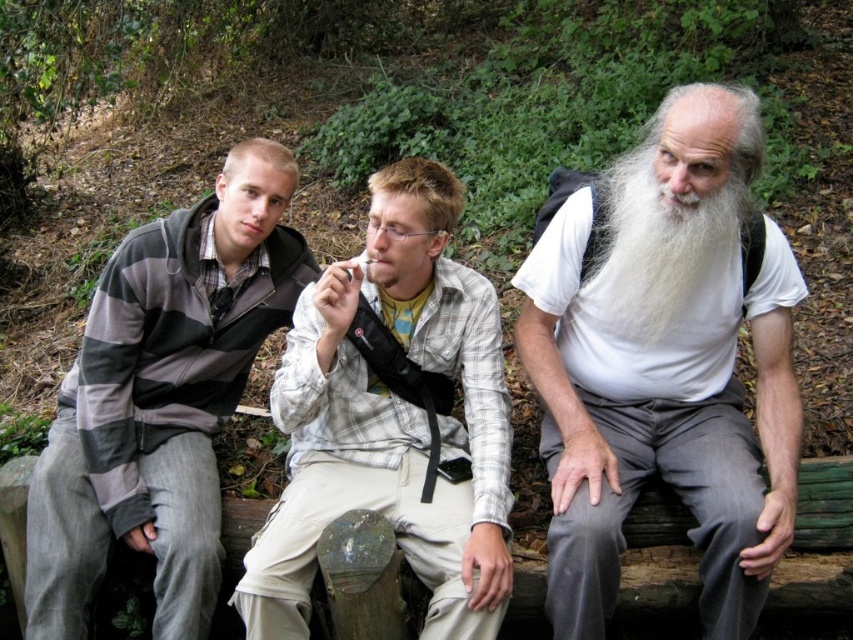
This screenshot has height=640, width=853. What are the coordinates of `striped fleece jacket at left` in the screenshot? It's located at pyautogui.click(x=161, y=400).

Who is more distant from viewer, (282, 291) or (642, 253)?

Positioned behind is point (282, 291).

Where is `striped fleece jacket at left`? The height and width of the screenshot is (640, 853). striped fleece jacket at left is located at coordinates (161, 400).

Can you confirm if striped fleece jacket at left is positioned to the right of light brown plaid shirt at center?

In fact, striped fleece jacket at left is to the left of light brown plaid shirt at center.

Between point (230, 240) and point (294, 310), which one is positioned in front?

Point (294, 310) is in front.

Which is in front, point (173, 593) or point (480, 401)?

Point (173, 593)

Find the location of a particular element. striped fleece jacket at left is located at coordinates (161, 400).

What do you see at coordinates (665, 365) in the screenshot? I see `white matte beard at center` at bounding box center [665, 365].

Is white matte beard at center shorter than striped fleece jacket at left?

Indeed, white matte beard at center has a lesser height compared to striped fleece jacket at left.

Measure the distance between point (679, 227) and camera.

Point (679, 227) is 6.99 feet away from camera.

Locate an element on the screen. Image resolution: width=853 pixels, height=640 pixels. white matte beard at center is located at coordinates coord(665,365).